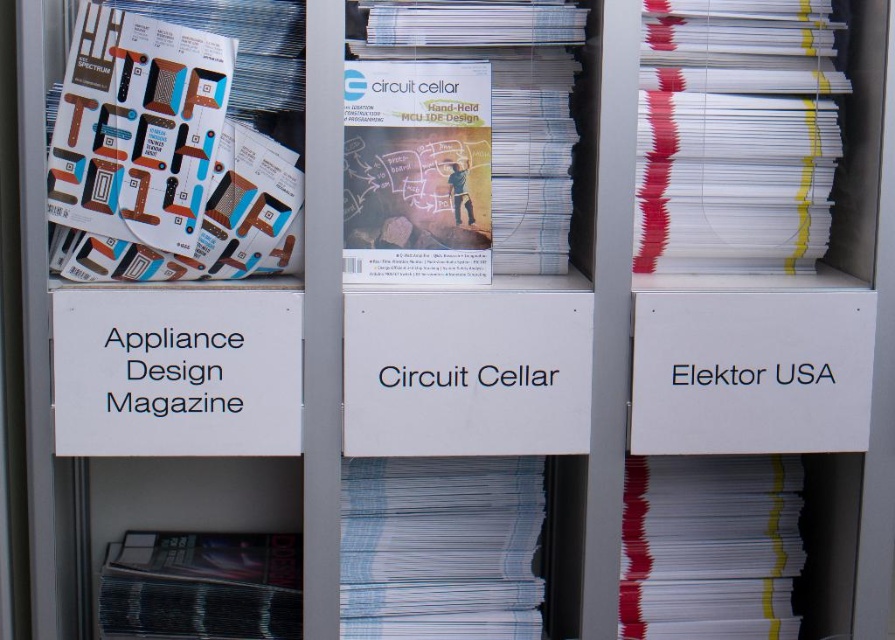
Question: Is white paper at center smaller than matte black magazine at lower left?

Choices:
 (A) yes
 (B) no

Answer: (B)

Question: Among these points, which one is nearest to the camera?

Choices:
 (A) (817, 90)
 (B) (541, 136)
 (C) (388, 481)
 (D) (49, 214)

Answer: (D)

Question: Can you confirm if white glossy magazine at center is bigger than white paper at center?

Choices:
 (A) no
 (B) yes

Answer: (B)

Question: Estimate the real-world distances between objects in this image. Which object is closer to the white paper at center?

Choices:
 (A) white paper stack at right
 (B) matte black magazine at lower left

Answer: (B)

Question: From the image, what is the correct spatial relationship of matte paper magazine at upper left in relation to white glossy paper at center?

Choices:
 (A) right
 (B) left

Answer: (B)

Question: Which object is positioned farthest from the white glossy paper at center?

Choices:
 (A) white glossy magazine at center
 (B) white paper at center
 (C) white paper stack at right
 (D) matte paper magazine at center

Answer: (D)